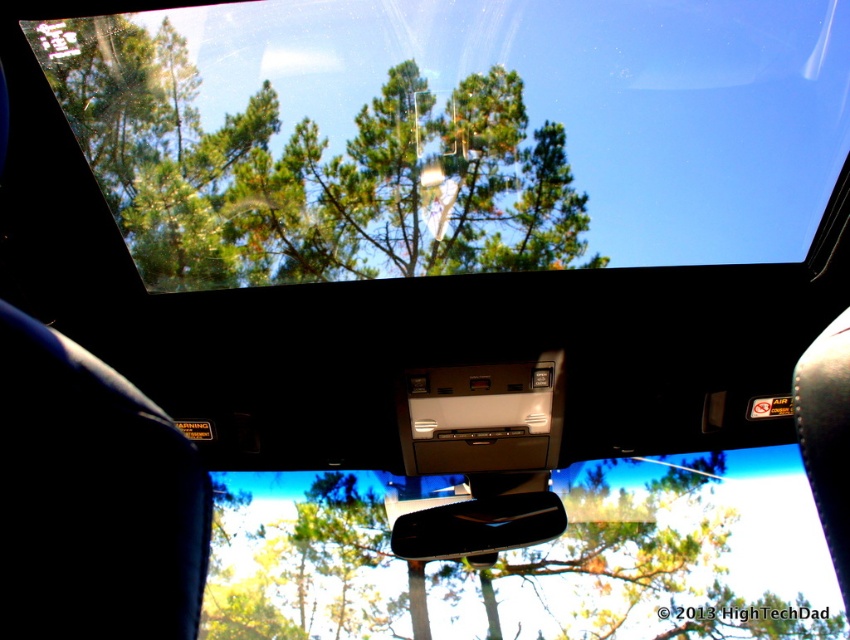
You are sitting in the car and want to see the green matte tree at center through the windshield. Can you see the black glossy car mirror at center in your view of the tree?

The black glossy car mirror at center is behind the green matte tree at center, so it would block your view of the tree.

You are sitting in the driver seat of the car and looking through the sunroof. There are two points marked on the windshield. The first point is at coordinate point (214, 624) and the second point is at coordinate point (480, 518). Which point is closer to your eyes?

Point (480, 518) is closer to your eyes because it is closer to the camera than point (214, 624).

You are sitting in the driver seat of the car and want to check the GPS mounted on the transparent glass windshield at upper center. Since you need to reach it, can you estimate if your arm can comfortably reach it from your current position?

The transparent glass windshield at upper center is 6.05 feet away from you. Since the average human arm length is about 2.5 feet, you cannot comfortably reach the GPS mounted on the transparent glass windshield at upper center from your current position.